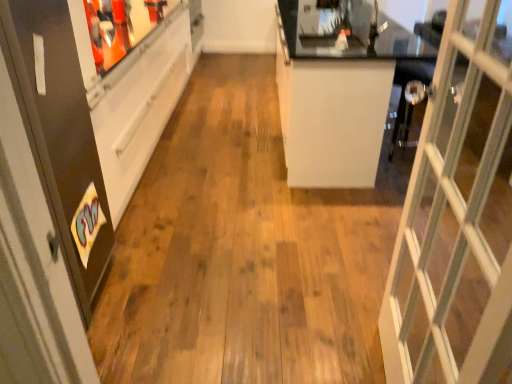
Describe the element at coordinates (340, 86) in the screenshot. This screenshot has height=384, width=512. I see `white glossy counter at center` at that location.

Where is `white glossy counter at center`? white glossy counter at center is located at coordinates tap(340, 86).

The height and width of the screenshot is (384, 512). What do you see at coordinates (60, 135) in the screenshot?
I see `matte black screen door at left` at bounding box center [60, 135].

In order to face matte black screen door at left, should I rotate leftwards or rightwards?

Rotate left and turn 29.938 degrees.

Image resolution: width=512 pixels, height=384 pixels. What are the coordinates of `matte black screen door at left` in the screenshot? It's located at point(60,135).

In order to click on white glossy counter at center in this screenshot , I will do 340,86.

Considering the relative positions of white glossy counter at center and matte black screen door at left in the image provided, is white glossy counter at center to the right of matte black screen door at left from the viewer's perspective?

Yes.

Who is more distant, white glossy counter at center or matte black screen door at left?

A: Positioned behind is white glossy counter at center.

Which is closer, [414,76] or [104,209]?

Point [414,76] is farther from the camera than point [104,209].

From the image's perspective, is white glossy counter at center over matte black screen door at left?

Yes, from the image's perspective, white glossy counter at center is above matte black screen door at left.

From a real-world perspective, which is physically above, white glossy counter at center or matte black screen door at left?

matte black screen door at left, from a real-world perspective.

Can you confirm if white glossy counter at center is wider than matte black screen door at left?

Yes.

Who is taller, white glossy counter at center or matte black screen door at left?

matte black screen door at left.

Based on their sizes in the image, would you say white glossy counter at center is bigger or smaller than matte black screen door at left?

Clearly, white glossy counter at center is larger in size than matte black screen door at left.

Do you think white glossy counter at center is within matte black screen door at left, or outside of it?

white glossy counter at center is not enclosed by matte black screen door at left.

Are white glossy counter at center and matte black screen door at left beside each other?

No, white glossy counter at center is not with matte black screen door at left.

Is white glossy counter at center oriented away from matte black screen door at left?

No, white glossy counter at center's orientation is not away from matte black screen door at left.

Looking at this image, how distant is white glossy counter at center from matte black screen door at left?

white glossy counter at center is 1.61 meters away from matte black screen door at left.

This screenshot has height=384, width=512. I want to click on screen door in front of the white glossy counter at center, so click(60, 135).

Between matte black screen door at left and white glossy counter at center, which one appears on the right side from the viewer's perspective?

white glossy counter at center.

Consider the image. Which object is further away from the camera, matte black screen door at left or white glossy counter at center?

white glossy counter at center.

Consider the image. Which is closer, (x=56, y=22) or (x=306, y=183)?

Point (x=56, y=22).

From the image's perspective, between matte black screen door at left and white glossy counter at center, who is located below?

matte black screen door at left.

From a real-world perspective, between matte black screen door at left and white glossy counter at center, who is vertically higher?

In real-world perspective, matte black screen door at left is above.

Based on the photo, considering the relative sizes of matte black screen door at left and white glossy counter at center in the image provided, is matte black screen door at left thinner than white glossy counter at center?

Correct, the width of matte black screen door at left is less than that of white glossy counter at center.

Is matte black screen door at left taller or shorter than white glossy counter at center?

Considering their sizes, matte black screen door at left has more height than white glossy counter at center.

Which of these two, matte black screen door at left or white glossy counter at center, is smaller?

Smaller between the two is matte black screen door at left.

Choose the correct answer: Is matte black screen door at left inside white glossy counter at center or outside it?

matte black screen door at left lies outside white glossy counter at center.

Is matte black screen door at left touching white glossy counter at center?

No, matte black screen door at left is not in contact with white glossy counter at center.

Is matte black screen door at left looking in the opposite direction of white glossy counter at center?

matte black screen door at left is not turned away from white glossy counter at center.

In the image, there is a matte black screen door at left. Where is `counter below it (from a real-world perspective)`? This screenshot has height=384, width=512. counter below it (from a real-world perspective) is located at coordinates (340, 86).

Locate an element on the screen. This screenshot has height=384, width=512. counter on the right side of matte black screen door at left is located at coordinates (340, 86).

The image size is (512, 384). I want to click on screen door on the left of white glossy counter at center, so click(60, 135).